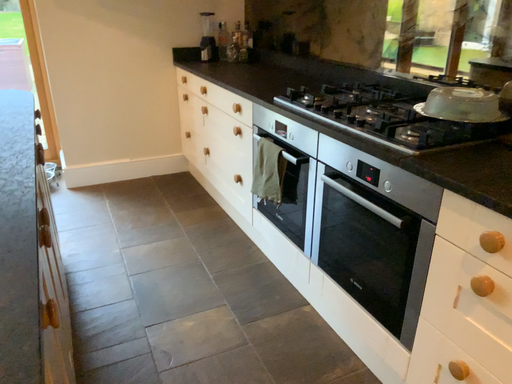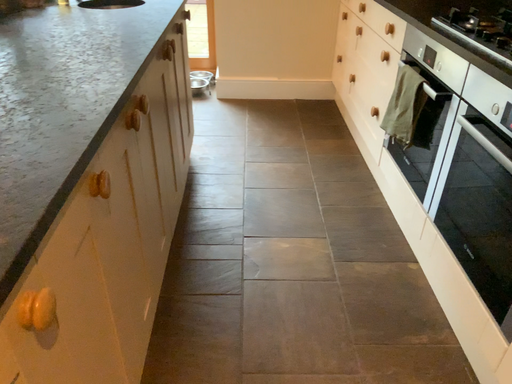
Question: Which way did the camera rotate in the video?

Choices:
 (A) rotated left
 (B) rotated right

Answer: (A)